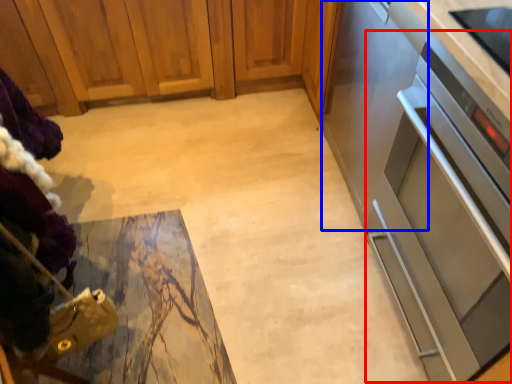
Question: Which object is further to the camera taking this photo, oven (highlighted by a red box) or appliance (highlighted by a blue box)?

Choices:
 (A) oven
 (B) appliance

Answer: (B)